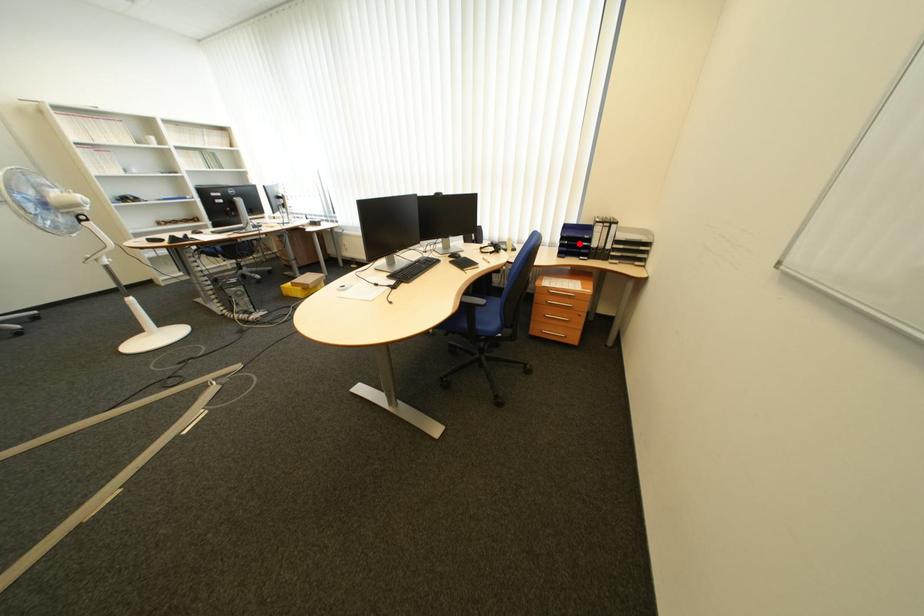
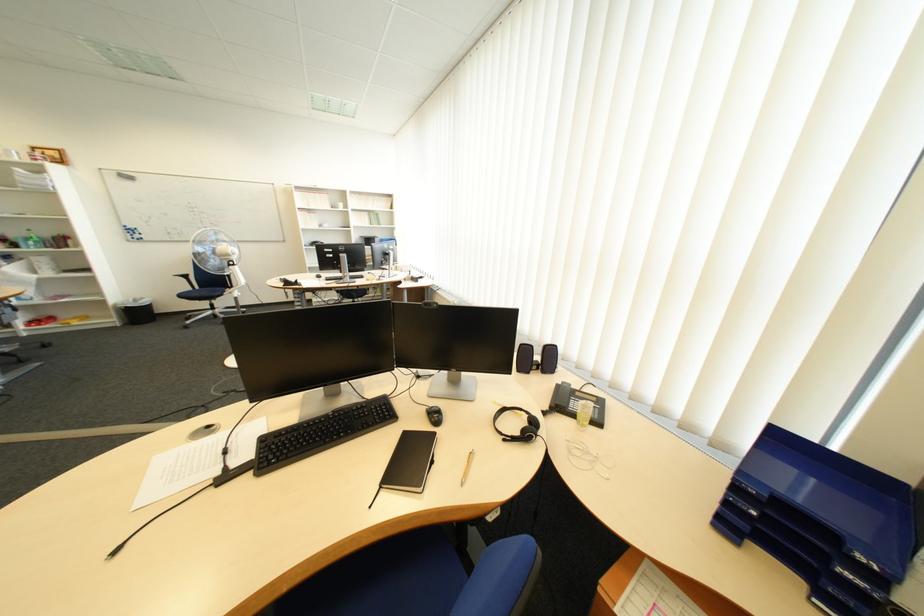
In the second image, find the point that corresponds to the highlighted location in the first image.

(767, 514)